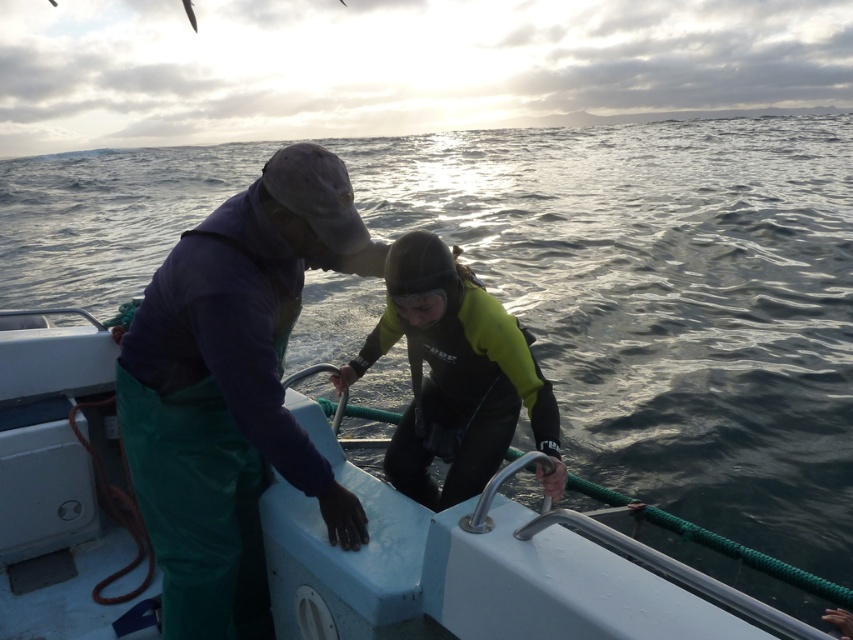
Does white plastic boat at center appear on the right side of neoprene wetsuit at center?

No, white plastic boat at center is not to the right of neoprene wetsuit at center.

Who is more distant from viewer, (55, 401) or (469, 477)?

Positioned behind is point (55, 401).

Is point (88, 378) closer to viewer compared to point (492, 410)?

No, (88, 378) is behind (492, 410).

Where is `white plastic boat at center`? white plastic boat at center is located at coordinates (473, 570).

Is green fabric pants at left to the right of neoprene wetsuit at center from the viewer's perspective?

In fact, green fabric pants at left is to the left of neoprene wetsuit at center.

Is point (173, 492) closer to viewer compared to point (497, 305)?

Yes.

At what (x,y) coordinates should I click in order to perform the action: click on green fabric pants at left. Please return your answer as a coordinate pair (x, y). The height and width of the screenshot is (640, 853). Looking at the image, I should click on (233, 388).

Measure the distance between green fabric pants at left and shiny silver fish at upper left.

9.38 meters

You are a GUI agent. You are given a task and a screenshot of the screen. Output one action in this format:
    pyautogui.click(x=<x>, y=<y>)
    Task: Click on the green fabric pants at left
    The width and height of the screenshot is (853, 640).
    Given the screenshot: What is the action you would take?
    pyautogui.click(x=233, y=388)